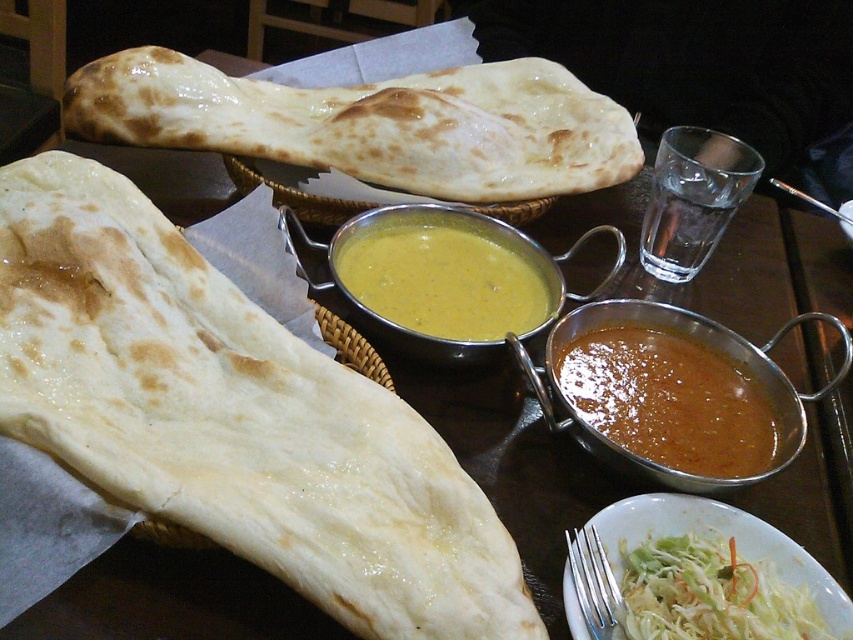
You are a food critic sitting at a table and see the white matte naan at upper center. Can you reach it without moving your chair?

The white matte naan at upper center is 24.94 inches away from you, so yes, you can reach it without moving your chair since the typical arm reach is around 26 inches.

You are a food delivery person who needs to pack the white matte naan at left and the yellow creamy soup at center into a box. The box can only accommodate one item if the other is too big. Which item should you prioritize packing first?

The white matte naan at left is larger than the yellow creamy soup at center, so you should prioritize packing the white matte naan at left first to ensure it fits properly.

Based on the photo, you are a customer at an Indian restaurant and want to reach the point at coordinates point (199, 124). If your hand is 12 inches long, can you comfortably reach it?

The distance between you and point (199, 124) is 25.85 inches, which is longer than your hand length of 12 inches. Therefore, you cannot comfortably reach it.